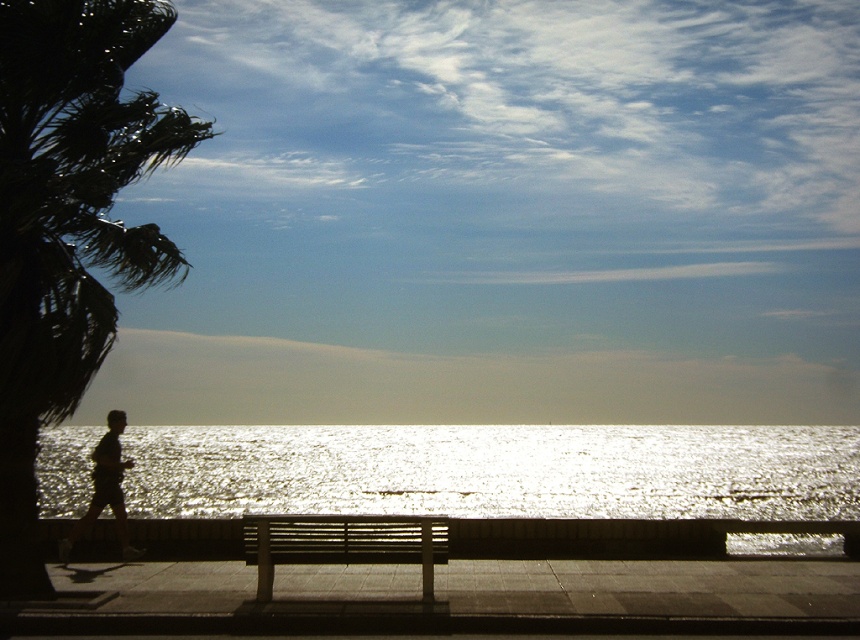
Question: Can you confirm if glistening silver water at center is positioned above dark silhouette figure at left?

Choices:
 (A) no
 (B) yes

Answer: (A)

Question: Is glistening silver water at center thinner than green leafy palm tree at left?

Choices:
 (A) no
 (B) yes

Answer: (A)

Question: Which point is farther to the camera?

Choices:
 (A) wooden slats bench at center
 (B) glistening silver water at center
 (C) dark silhouette figure at left
 (D) green leafy palm tree at left

Answer: (B)

Question: Which point appears closest to the camera in this image?

Choices:
 (A) (95, 467)
 (B) (108, 144)

Answer: (B)

Question: Based on their relative distances, which object is nearer to the wooden slats bench at center?

Choices:
 (A) green leafy palm tree at left
 (B) dark silhouette figure at left
 (C) glistening silver water at center

Answer: (A)

Question: Can you confirm if glistening silver water at center is positioned above dark silhouette figure at left?

Choices:
 (A) no
 (B) yes

Answer: (A)